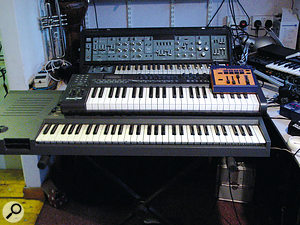
I want to click on box, so click(226, 196).